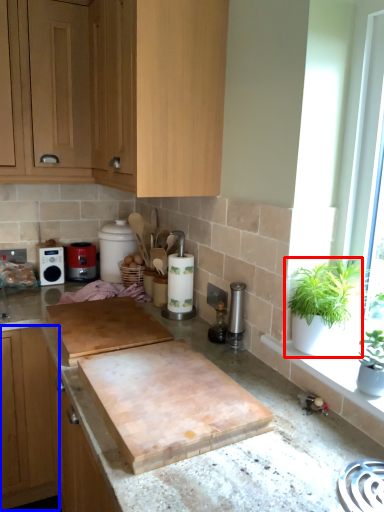
Question: Which point is further to the camera, houseplant (highlighted by a red box) or cabinetry (highlighted by a blue box)?

Choices:
 (A) houseplant
 (B) cabinetry

Answer: (B)